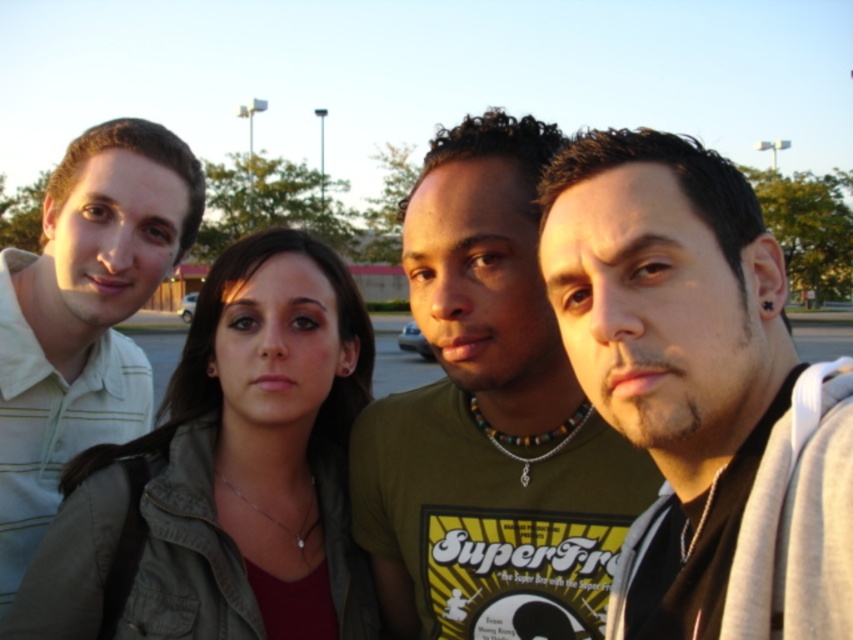
Question: Is matte black shirt at center below light green striped shirt at left?

Choices:
 (A) no
 (B) yes

Answer: (B)

Question: From the image, what is the correct spatial relationship of matte black shirt at center in relation to matte olive green jacket at center?

Choices:
 (A) above
 (B) below

Answer: (A)

Question: Which of the following is the farthest from the observer?

Choices:
 (A) matte black shirt at center
 (B) light green striped shirt at left
 (C) green t-shirt at center
 (D) matte olive green jacket at center

Answer: (B)

Question: Which of the following is the closest to the observer?

Choices:
 (A) (763, 417)
 (B) (271, 449)

Answer: (A)

Question: Estimate the real-world distances between objects in this image. Which object is farther from the matte black shirt at center?

Choices:
 (A) green t-shirt at center
 (B) matte olive green jacket at center

Answer: (B)

Question: Can you confirm if matte black shirt at center is positioned above green t-shirt at center?

Choices:
 (A) no
 (B) yes

Answer: (A)